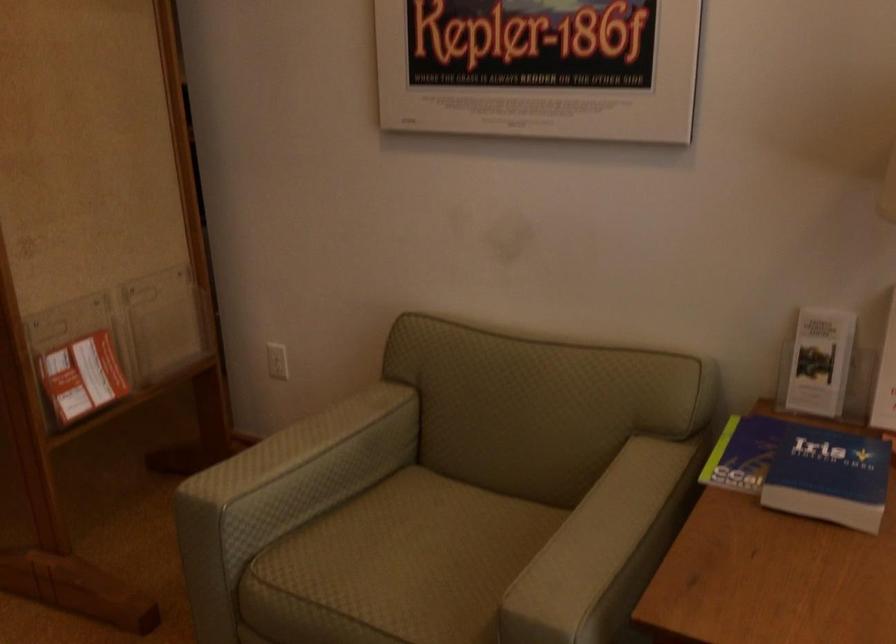
Find where to lift the red and white brochure. Please return your answer as a coordinate pair (x, y).

(82, 377)